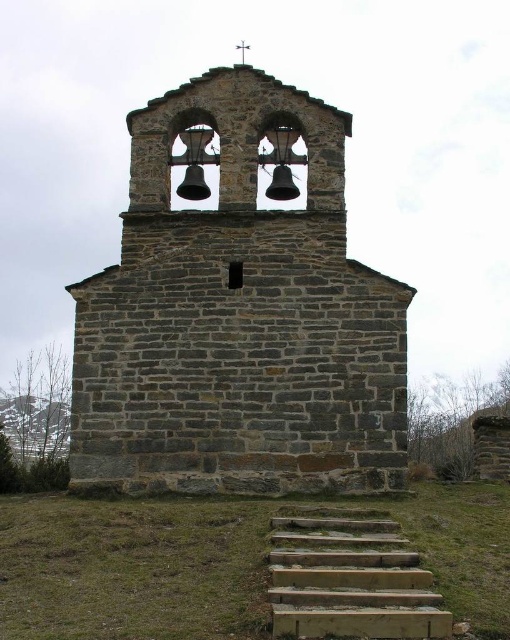
You are standing at the base of the rustic stone bell tower and want to place a decorative stone planter. The planter needs to be positioned exactly at the coordinates mentioned for the green grass at lower center. What are the coordinates where you should place the planter?

The coordinates for the green grass at lower center are (134,566), so you should place the decorative stone planter at those exact coordinates.

You are standing at the base of the rustic stone bell tower and notice two points marked on the tower. The first point is at coordinates point (x=286, y=300) and the second is at point (x=434, y=554). From your vantage point, which point appears closer to you?

Point (x=434, y=554) appears closer because it is in front of point (x=286, y=300) according to their spatial relationship.

You are standing in a field and see the gray stone church at center and the green grass at lower center. Which object is closer to you?

The gray stone church at center is closer to you since the green grass at lower center is behind it.